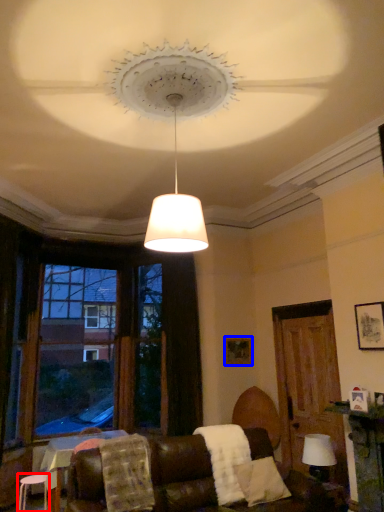
Question: Which of the following is the farthest to the observer, stool (highlighted by a red box) or picture frame (highlighted by a blue box)?

Choices:
 (A) stool
 (B) picture frame

Answer: (B)